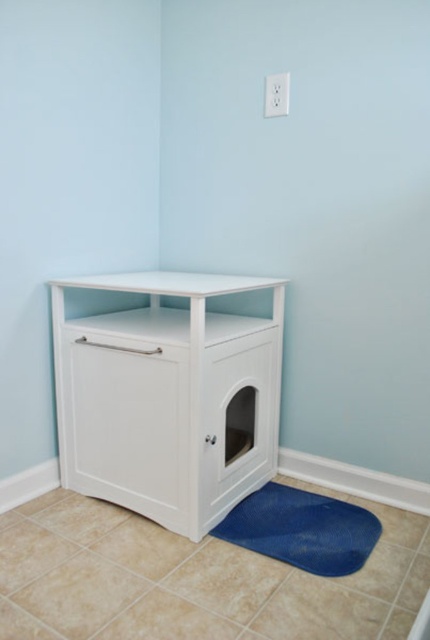
You are placing a new decorative plant pot in the room. The plant pot needs to be placed 0.5 meters away from the white matte cabinet at lower left. According to the room coordinates, where should you place the plant pot?

The white matte cabinet at lower left is located at point (165,396). To place the plant pot 0.5 meters away from it, you should position it at coordinates that are 0.5 meters away from this point in the desired direction, ensuring it fits within the room layout.

You are a cat owner who wants to place a new litter box inside the white matte cabinet at lower left and the blue textured mat at lower center. According to the scene, where should the litter box be placed?

The white matte cabinet at lower left is positioned over the blue textured mat at lower center, so the litter box should be placed inside the white matte cabinet at lower left as it is designed for that purpose and sits above the mat.

You are a cat owner who wants to place a new cat toy box between the white matte cabinet at lower left and the blue textured mat at lower center. Which side of the cat toy box should be closer to the wider object?

The white matte cabinet at lower left is wider than the blue textured mat at lower center. Therefore, the cat toy box should be placed closer to the blue textured mat at lower center to ensure enough space for the wider cabinet.